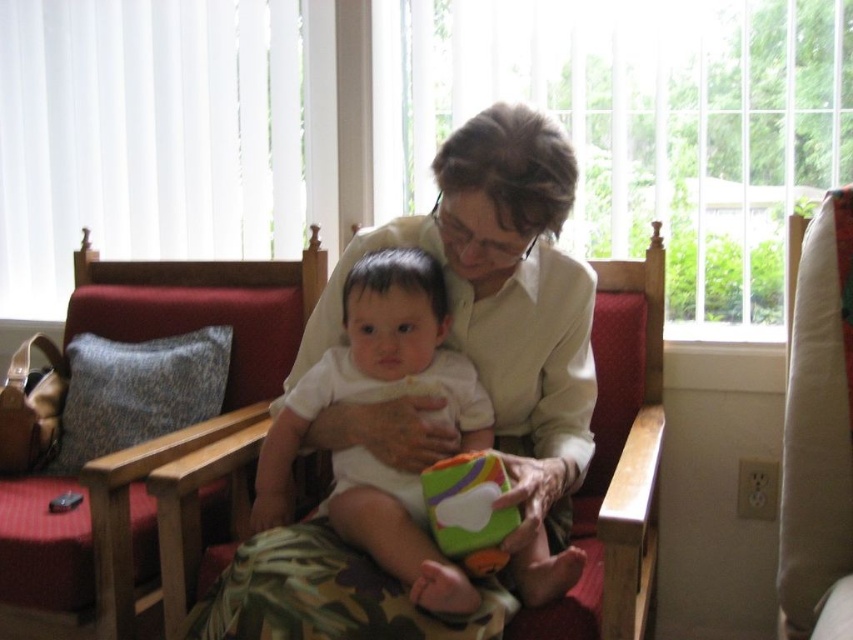
Does beige fabric rocking chair at right have a greater height compared to matte green plush cube at center?

Yes, beige fabric rocking chair at right is taller than matte green plush cube at center.

Who is positioned more to the left, beige fabric rocking chair at right or matte green plush cube at center?

Positioned to the left is matte green plush cube at center.

The width and height of the screenshot is (853, 640). What do you see at coordinates (817, 422) in the screenshot? I see `beige fabric rocking chair at right` at bounding box center [817, 422].

This screenshot has height=640, width=853. I want to click on beige fabric rocking chair at right, so click(x=817, y=422).

Can you confirm if red fabric rocking chair at left is positioned below beige fabric rocking chair at right?

Actually, red fabric rocking chair at left is above beige fabric rocking chair at right.

Is red fabric rocking chair at left shorter than beige fabric rocking chair at right?

Correct, red fabric rocking chair at left is not as tall as beige fabric rocking chair at right.

The height and width of the screenshot is (640, 853). I want to click on red fabric rocking chair at left, so click(x=135, y=440).

I want to click on red fabric rocking chair at left, so click(135, 440).

Measure the distance between point (354, 269) and camera.

Point (354, 269) and camera are 4.38 feet apart from each other.

Between white matte onesie at center and matte green plush cube at center, which one is positioned lower?

matte green plush cube at center is lower down.

Identify the location of white matte onesie at center. (376, 368).